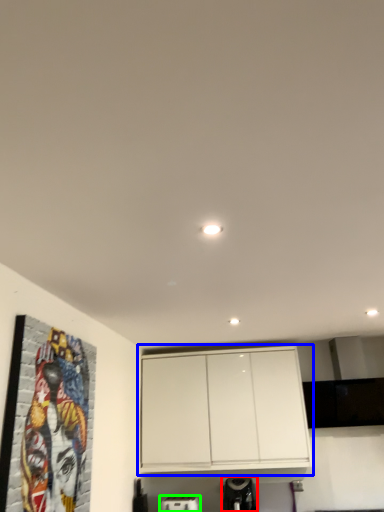
Question: Which object is the closest to the appliance (highlighted by a red box)? Choose among these: cabinetry (highlighted by a blue box) or appliance (highlighted by a green box).

Choices:
 (A) cabinetry
 (B) appliance

Answer: (B)